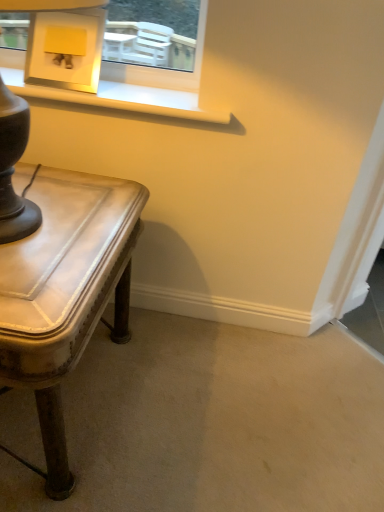
Find the location of `free region under matte brown table lamp at left (from a real-world perspective)`. free region under matte brown table lamp at left (from a real-world perspective) is located at coordinates (57, 224).